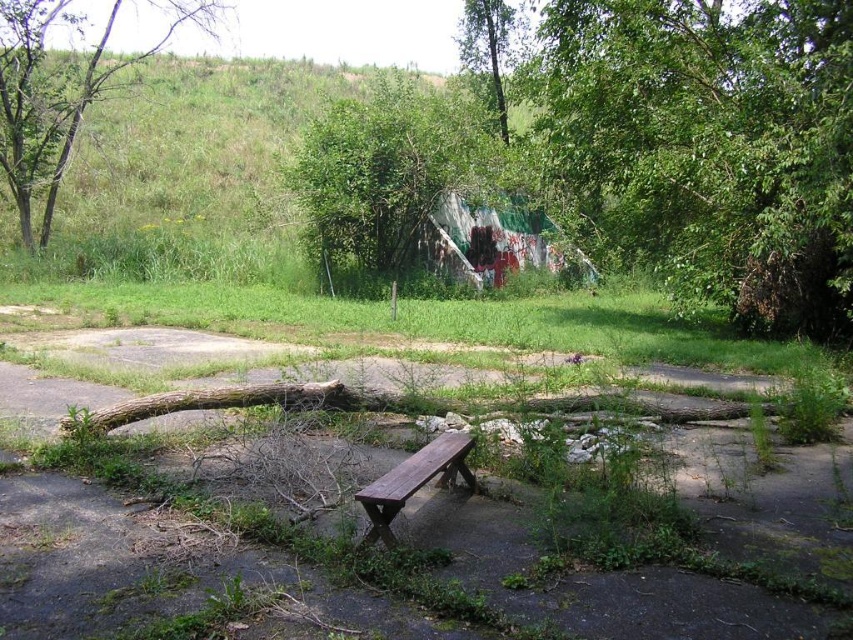
Based on the photo, you are a park maintenance worker who needs to trim two trees. The trees are the green leafy tree at upper right and the green leafy tree at upper center. The equipment you have can reach up to 10 meters between trees. Can you safely trim both trees with your current equipment?

The distance between the green leafy tree at upper right and the green leafy tree at upper center is 12.05 meters. Since your equipment can only reach up to 10 meters between trees, you cannot safely trim both trees with your current equipment.

You are planning to install a new bench in this park area. You want to place it so that it faces away from both the green leafy tree at upper right and the green leafy tree at upper left. Which direction should the bench face?

The green leafy tree at upper right is shorter than the green leafy tree at upper left. To face away from both trees, the bench should be oriented towards the lower part of the image, opposite the trees.